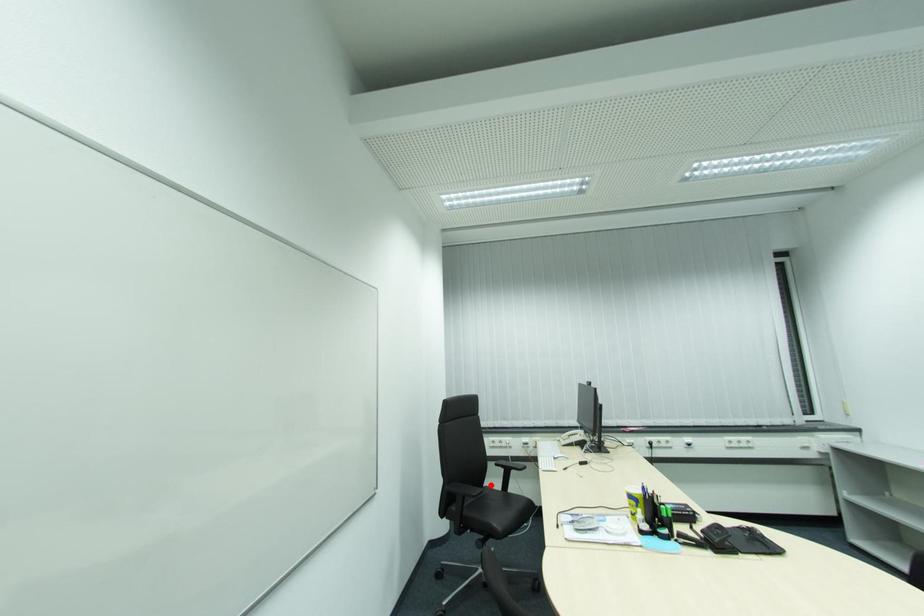
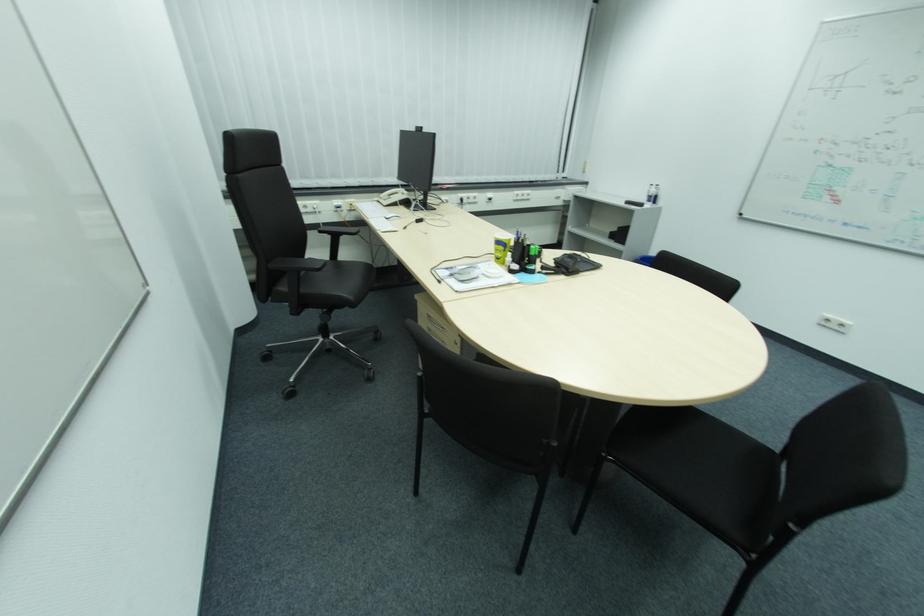
Where in the second image is the point corresponding to the highlighted location from the first image?

(311, 257)